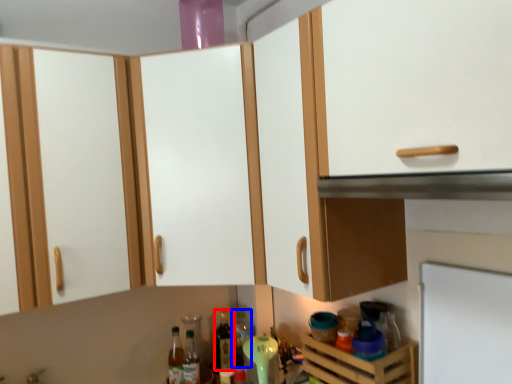
Question: Which object is further to the camera taking this photo, bottle (highlighted by a red box) or bottle (highlighted by a blue box)?

Choices:
 (A) bottle
 (B) bottle

Answer: (B)